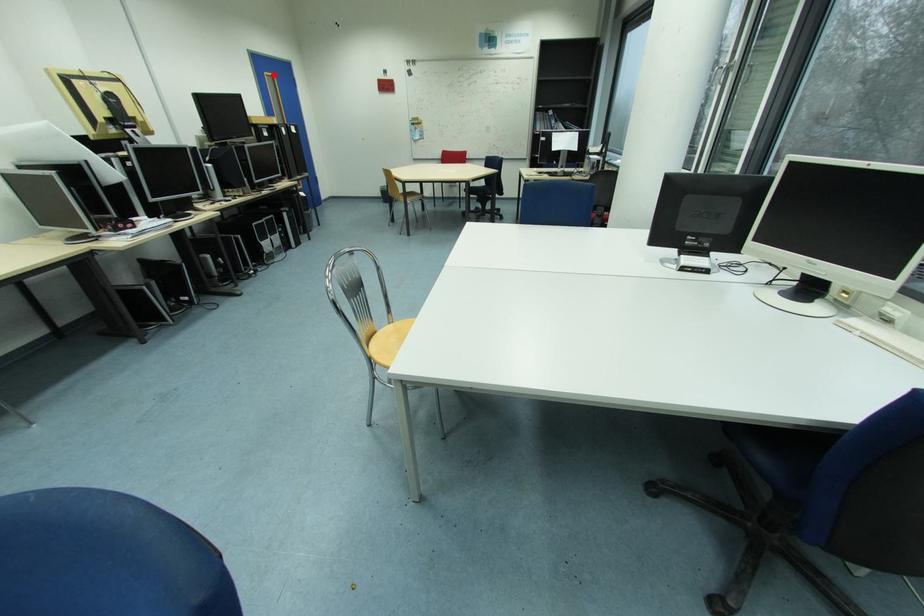
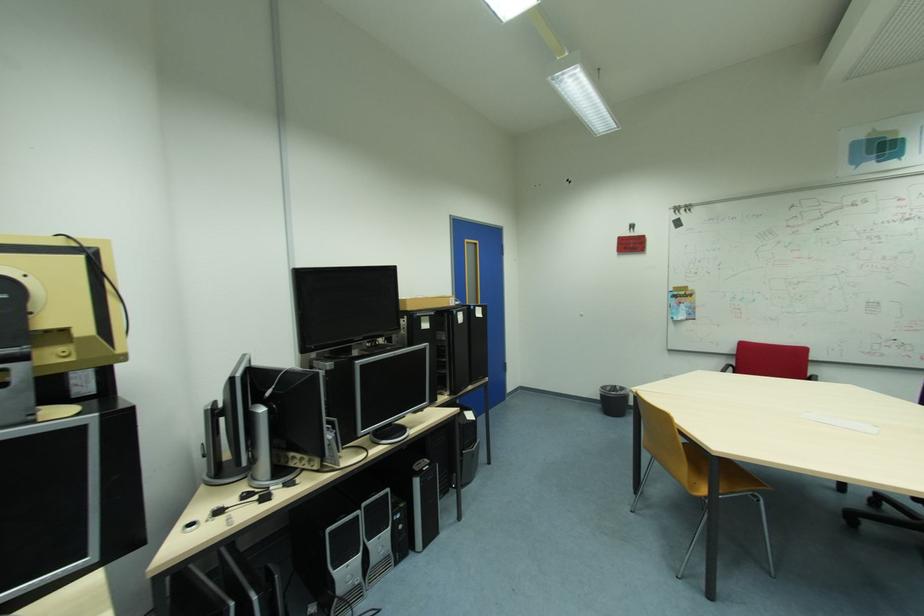
Find the pixel in the second image that matches the highlighted location in the first image.

(473, 241)